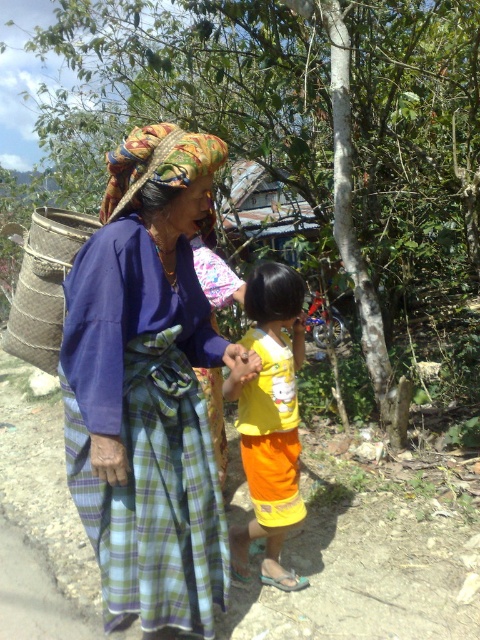
Which is more to the left, plaid fabric headscarf at center or yellow matte shirt at center?

Positioned to the left is plaid fabric headscarf at center.

Does point (123, 387) lie in front of point (275, 289)?

Yes, it is in front of point (275, 289).

The height and width of the screenshot is (640, 480). In order to click on plaid fabric headscarf at center in this screenshot , I will do `click(147, 388)`.

Can you confirm if yellow matte shirt at center is shorter than natural woven basket at left?

No.

Is the position of yellow matte shirt at center more distant than that of natural woven basket at left?

No.

This screenshot has width=480, height=640. Find the location of `yellow matte shirt at center`. yellow matte shirt at center is located at coordinates [x=269, y=420].

Which is more to the right, plaid fabric headscarf at center or natural woven basket at left?

plaid fabric headscarf at center

Does plaid fabric headscarf at center have a smaller size compared to natural woven basket at left?

Actually, plaid fabric headscarf at center might be larger than natural woven basket at left.

Describe the element at coordinates (147, 388) in the screenshot. I see `plaid fabric headscarf at center` at that location.

Locate an element on the screen. plaid fabric headscarf at center is located at coordinates (147, 388).